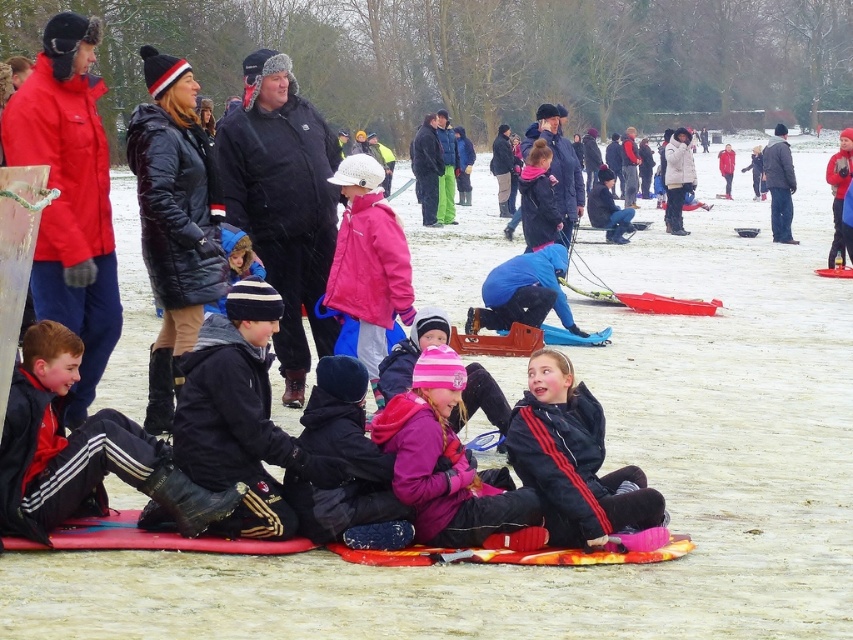
You are a GUI agent. You are given a task and a screenshot of the screen. Output one action in this format:
    pyautogui.click(x=<x>, y=<y>)
    Task: Click on the black matte coat at upper center
    The height and width of the screenshot is (640, 853).
    Given the screenshot: What is the action you would take?
    pyautogui.click(x=283, y=202)

Identify the location of black matte coat at upper center. The image size is (853, 640). (283, 202).

Is black matte coat at upper center further to camera compared to black leather jacket at lower left?

Yes, it is.

Can you confirm if black matte coat at upper center is positioned to the left of black leather jacket at lower left?

In fact, black matte coat at upper center is to the right of black leather jacket at lower left.

Which is behind, point (322, 170) or point (57, 372)?

The point (322, 170) is more distant.

I want to click on black matte coat at upper center, so click(283, 202).

Which is more to the left, black leather jacket at lower left or pink fleece jacket at lower center?

black leather jacket at lower left is more to the left.

Is black leather jacket at lower left to the right of pink fleece jacket at lower center from the viewer's perspective?

Incorrect, black leather jacket at lower left is not on the right side of pink fleece jacket at lower center.

Based on the photo, who is more distant from viewer, (16,472) or (440,467)?

Point (440,467)

You are a GUI agent. You are given a task and a screenshot of the screen. Output one action in this format:
    pyautogui.click(x=<x>, y=<y>)
    Task: Click on the black leather jacket at lower left
    
    Given the screenshot: What is the action you would take?
    pyautogui.click(x=82, y=451)